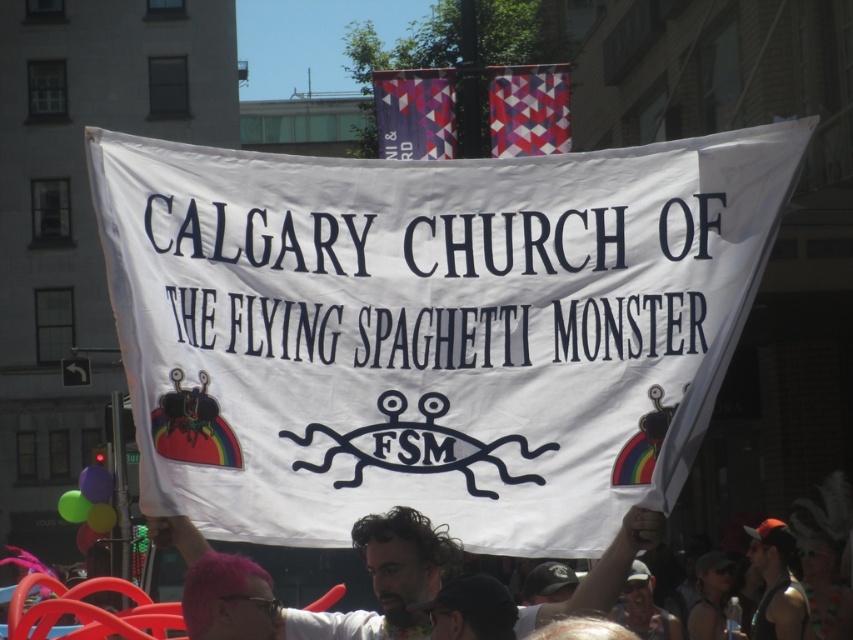
Between black fabric cap at lower right and translucent plastic balloon at lower left, which one has less height?

With less height is translucent plastic balloon at lower left.

The height and width of the screenshot is (640, 853). What do you see at coordinates (776, 582) in the screenshot?
I see `black fabric cap at lower right` at bounding box center [776, 582].

Who is more forward, (x=758, y=531) or (x=111, y=490)?

Point (x=758, y=531)

Image resolution: width=853 pixels, height=640 pixels. I want to click on black fabric cap at lower right, so click(x=776, y=582).

Can you confirm if white paper banner at center is positioned above translucent plastic balloon at lower left?

Yes, white paper banner at center is above translucent plastic balloon at lower left.

Based on the photo, can you confirm if white paper banner at center is positioned below translucent plastic balloon at lower left?

No, white paper banner at center is not below translucent plastic balloon at lower left.

The width and height of the screenshot is (853, 640). In order to click on white paper banner at center in this screenshot , I will do `click(430, 330)`.

Identify the location of white paper banner at center. (430, 330).

Does curly hair at center have a greater width compared to rubber balloons at lower left?

Yes.

In the scene shown: Is curly hair at center bigger than rubber balloons at lower left?

Answer: Incorrect, curly hair at center is not larger than rubber balloons at lower left.

Identify the location of curly hair at center. (381, 579).